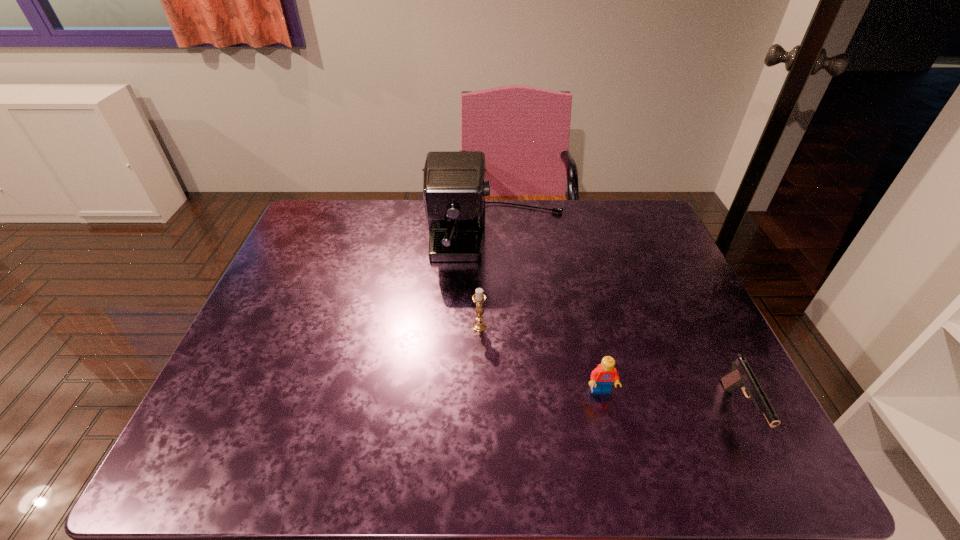
Image resolution: width=960 pixels, height=540 pixels. What are the coordinates of `vacant area at the near right corner` in the screenshot? It's located at (725, 443).

Find the location of `free spot between the rightmost object and the Lego`. free spot between the rightmost object and the Lego is located at coordinates (670, 401).

Where is `free space between the second tallest object and the tallest object`? free space between the second tallest object and the tallest object is located at coordinates (489, 281).

Where is `free space between the coffee maker and the candle holder`? The height and width of the screenshot is (540, 960). free space between the coffee maker and the candle holder is located at coordinates (489, 281).

Locate an element on the screen. free spot between the coffee maker and the Lego is located at coordinates (550, 314).

At what (x,y) coordinates should I click in order to perform the action: click on blank region between the tallest object and the candle holder. Please return your answer as a coordinate pair (x, y). This screenshot has width=960, height=540. Looking at the image, I should click on (489, 281).

Where is `unoccupied position between the candle holder and the tallest object`? The width and height of the screenshot is (960, 540). unoccupied position between the candle holder and the tallest object is located at coordinates (489, 281).

The width and height of the screenshot is (960, 540). I want to click on free space that is in between the Lego and the pistol, so click(670, 401).

Locate an element on the screen. object that is the third closest to the farthest object is located at coordinates (741, 376).

Where is `object that is the closest to the Lego`? This screenshot has width=960, height=540. object that is the closest to the Lego is located at coordinates (741, 376).